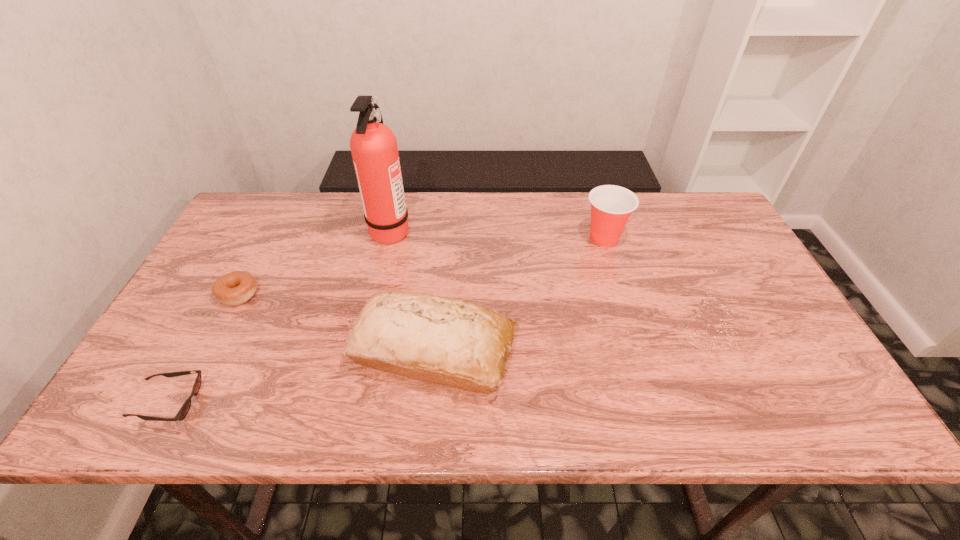
Where is `fire extinguisher that is at the far edge`? Image resolution: width=960 pixels, height=540 pixels. fire extinguisher that is at the far edge is located at coordinates (373, 145).

At what (x,y) coordinates should I click in order to perform the action: click on cup present at the far edge. Please return your answer as a coordinate pair (x, y). Image resolution: width=960 pixels, height=540 pixels. Looking at the image, I should click on (611, 206).

What are the coordinates of `bread situated at the near edge` in the screenshot? It's located at (445, 341).

Image resolution: width=960 pixels, height=540 pixels. I want to click on sunglasses that is at the near edge, so click(x=185, y=408).

At what (x,y) coordinates should I click in order to perform the action: click on bagel positioned at the left edge. Please return your answer as a coordinate pair (x, y). Image resolution: width=960 pixels, height=540 pixels. Looking at the image, I should click on (235, 288).

Locate an element on the screen. The height and width of the screenshot is (540, 960). sunglasses that is at the left edge is located at coordinates (185, 408).

This screenshot has width=960, height=540. Find the location of `object located at the near left corner`. object located at the near left corner is located at coordinates (185, 408).

Where is `free space at the far edge`? The height and width of the screenshot is (540, 960). free space at the far edge is located at coordinates (328, 216).

The image size is (960, 540). In the image, there is a desktop. Identify the location of blank space at the near edge. (704, 426).

I want to click on free space at the left edge of the desktop, so click(x=214, y=263).